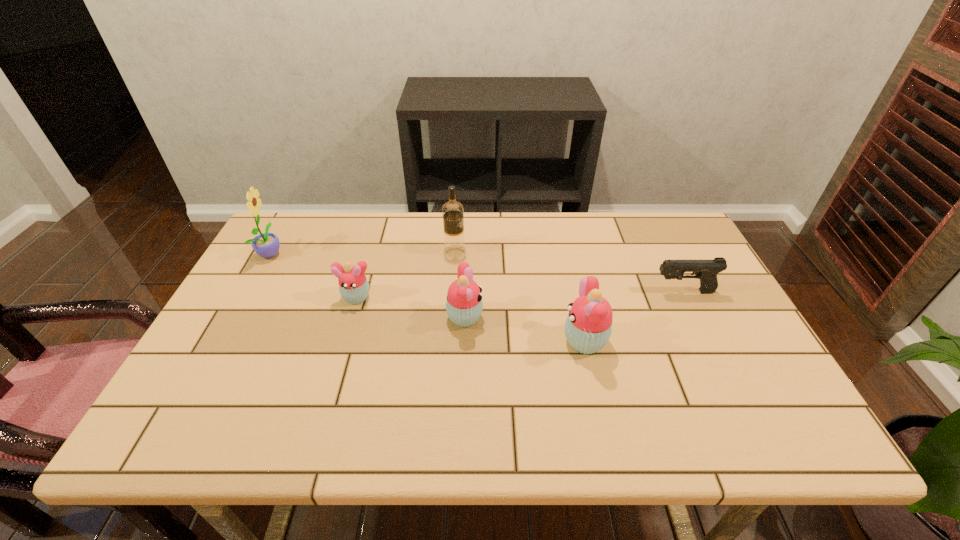
This screenshot has width=960, height=540. In order to click on cupcake that is the third closest to the vodka in this screenshot , I will do `click(588, 327)`.

Find the location of a particular element. vacant point that satisfies the following two spatial constraints: 1. on the label of the vodka; 2. on the face of the second object from left to right is located at coordinates (452, 297).

You are a GUI agent. You are given a task and a screenshot of the screen. Output one action in this format:
    pyautogui.click(x=<x>, y=<y>)
    Task: Click on the vacant area in the image that satisfies the following two spatial constraints: 1. on the label of the vodka; 2. on the face of the fifth object from right to left
    This screenshot has height=540, width=960.
    Given the screenshot: What is the action you would take?
    pyautogui.click(x=452, y=297)